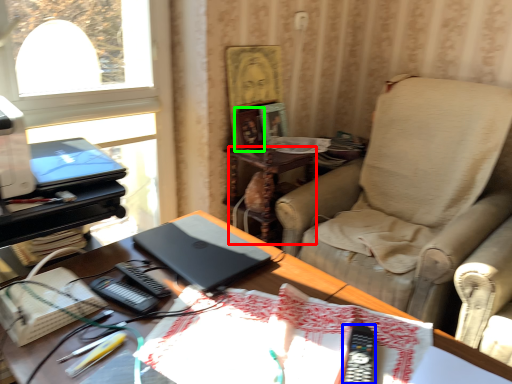
Question: Based on their relative distances, which object is nearer to side table (highlighted by a red box)? Choose from equipment (highlighted by a blue box) and picture frame (highlighted by a green box).

Choices:
 (A) equipment
 (B) picture frame

Answer: (B)